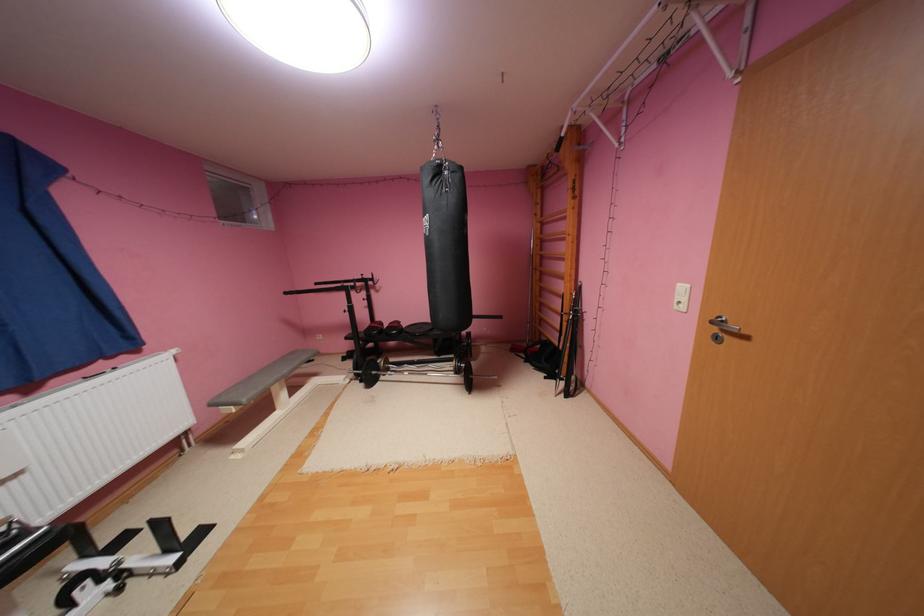
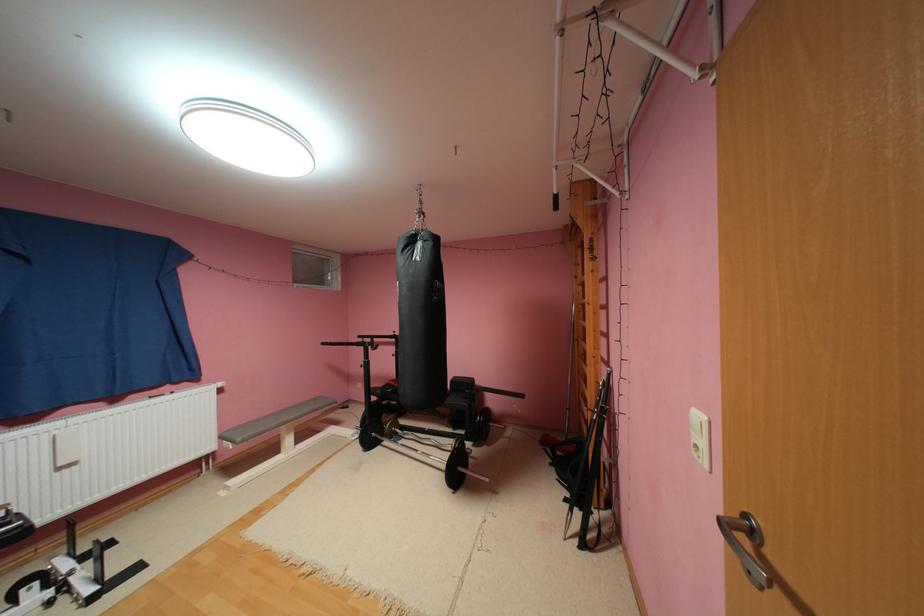
The point at (357, 379) is marked in the first image. Where is the corresponding point in the second image?

(366, 436)